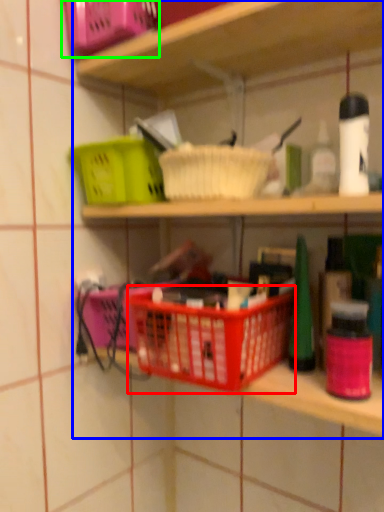
Question: Which object is the closest to the basket container (highlighted by a red box)? Choose among these: shelf (highlighted by a blue box) or basket (highlighted by a green box).

Choices:
 (A) shelf
 (B) basket

Answer: (A)